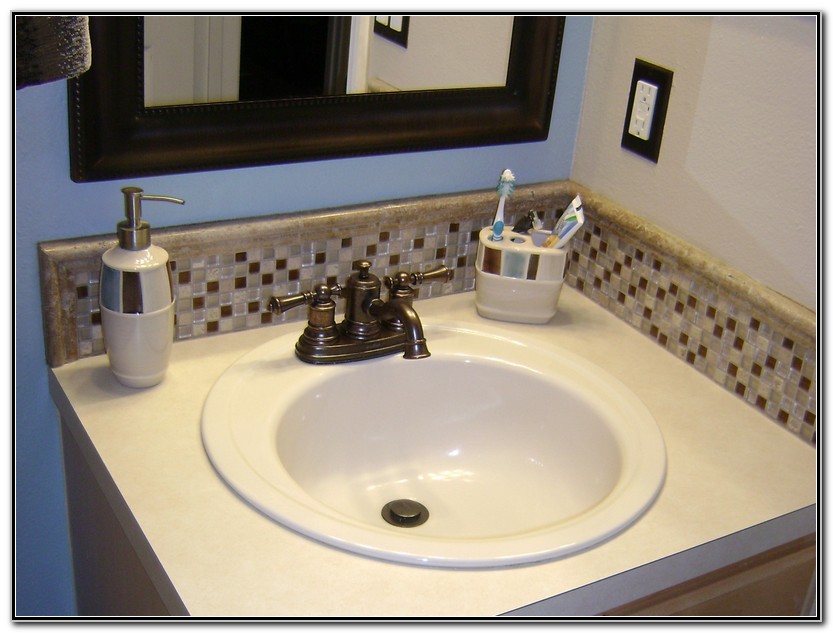
You are a GUI agent. You are given a task and a screenshot of the screen. Output one action in this format:
    pyautogui.click(x=<x>, y=<y>)
    Task: Click on the white sink
    
    Given the screenshot: What is the action you would take?
    pyautogui.click(x=506, y=458)